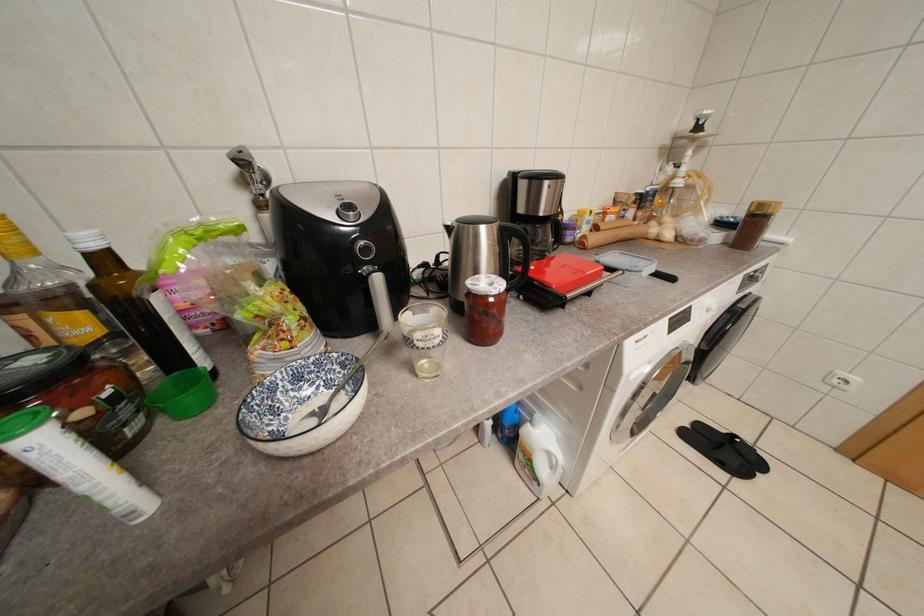
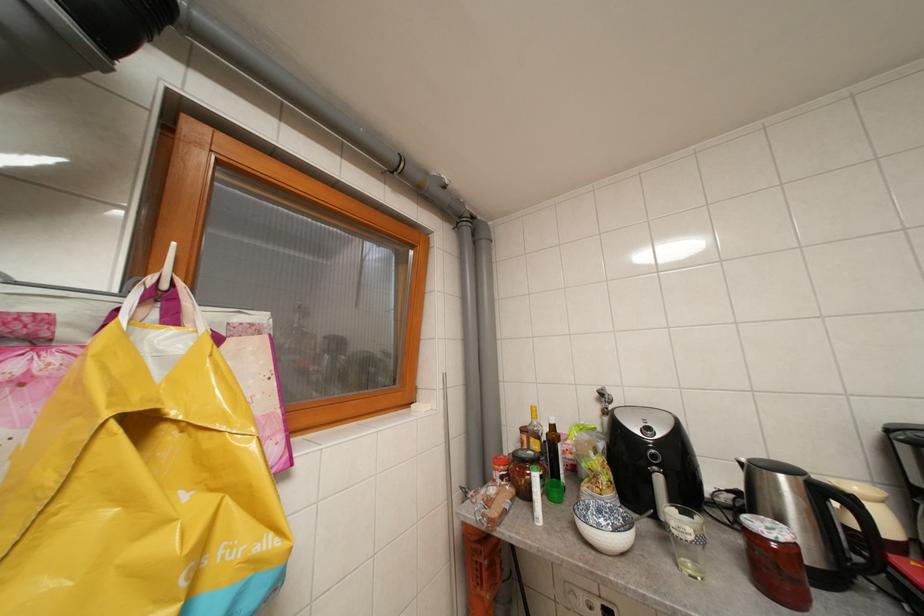
The images are taken continuously from a first-person perspective. In which direction is your viewpoint rotating?

The camera's rotation is toward left-up.